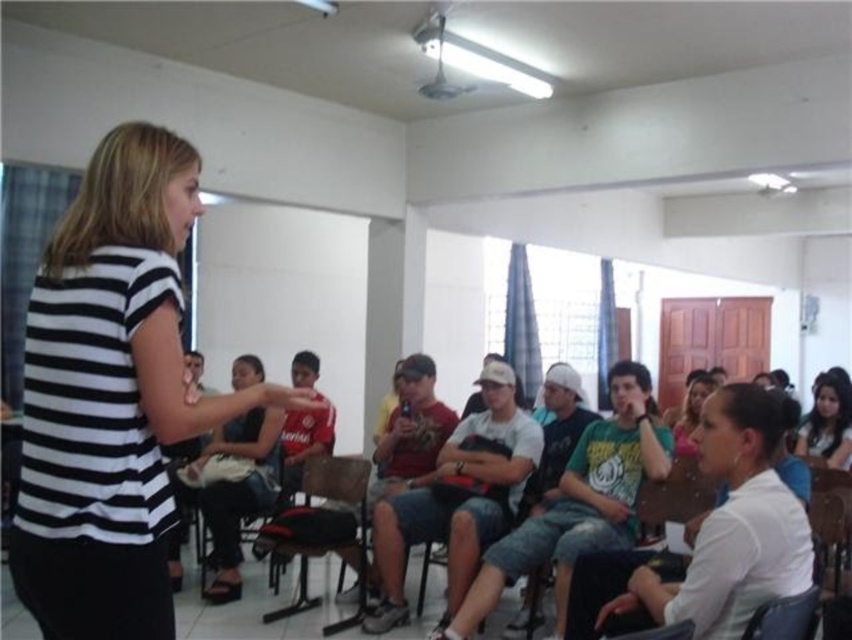
Question: Where is black fabric chair at center located in relation to black leather chair at lower right in the image?

Choices:
 (A) left
 (B) right

Answer: (A)

Question: Which object is farther from the camera taking this photo?

Choices:
 (A) black fabric chair at center
 (B) matte black hair at lower right

Answer: (B)

Question: Which object appears farthest from the camera in this image?

Choices:
 (A) black leather chair at lower right
 (B) black striped shirt at center
 (C) wooden chair at center

Answer: (C)

Question: Among these points, which one is farthest from the camera?

Choices:
 (A) (833, 424)
 (B) (807, 604)
 (C) (137, 227)

Answer: (A)

Question: Does white matte shirt at lower right appear on the left side of wooden chair at center?

Choices:
 (A) no
 (B) yes

Answer: (A)

Question: Can you confirm if white matte shirt at lower right is positioned above matte black hair at lower right?

Choices:
 (A) yes
 (B) no

Answer: (B)